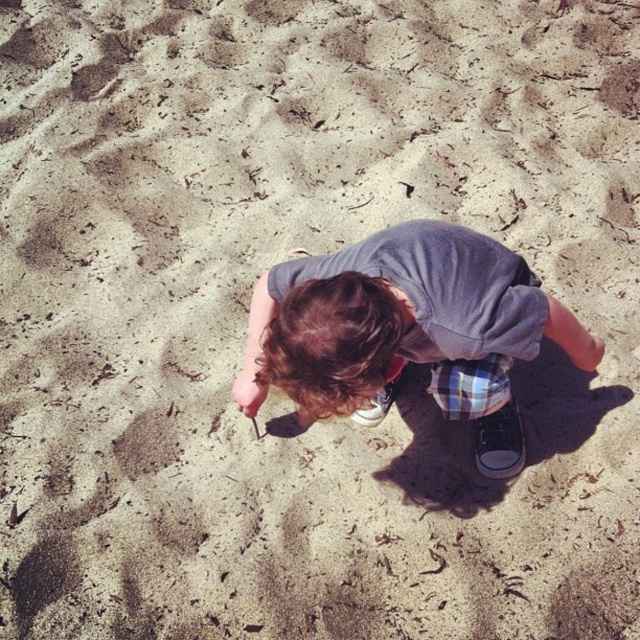
Does point (330, 388) come farther from viewer compared to point (477, 234)?

No.

Between gray cotton shirt at center and gray fabric at center, which one has less height?

gray fabric at center

Does point (468, 392) lie behind point (355, 262)?

Yes, it is behind point (355, 262).

Where is `gray cotton shirt at center`? The width and height of the screenshot is (640, 640). gray cotton shirt at center is located at coordinates (401, 323).

Who is positioned more to the left, gray fabric at center or matte gray shoe at center?

matte gray shoe at center is more to the left.

Is the position of gray fabric at center more distant than that of matte gray shoe at center?

No, gray fabric at center is in front of matte gray shoe at center.

Describe the element at coordinates (440, 289) in the screenshot. The image size is (640, 640). I see `gray fabric at center` at that location.

Locate an element on the screen. This screenshot has height=640, width=640. gray fabric at center is located at coordinates (440, 289).

Which is more to the left, gray cotton shirt at center or black canvas shoe at lower right?

From the viewer's perspective, gray cotton shirt at center appears more on the left side.

Between gray cotton shirt at center and black canvas shoe at lower right, which one has less height?

black canvas shoe at lower right

Who is more forward, (x=346, y=340) or (x=497, y=417)?

Point (x=346, y=340) is in front.

What are the coordinates of `gray cotton shirt at center` in the screenshot? It's located at (401, 323).